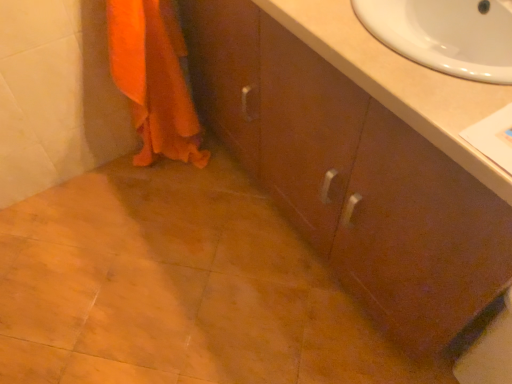
Question: Is matte brown cabinet at center next to beige laminate sink at upper right?

Choices:
 (A) no
 (B) yes

Answer: (A)

Question: Is matte brown cabinet at center located outside beige laminate sink at upper right?

Choices:
 (A) yes
 (B) no

Answer: (A)

Question: Is matte brown cabinet at center facing away from beige laminate sink at upper right?

Choices:
 (A) yes
 (B) no

Answer: (B)

Question: Does matte brown cabinet at center come behind beige laminate sink at upper right?

Choices:
 (A) no
 (B) yes

Answer: (A)

Question: Is matte brown cabinet at center at the left side of beige laminate sink at upper right?

Choices:
 (A) no
 (B) yes

Answer: (B)

Question: Does point (432, 167) appear closer or farther from the camera than point (196, 142)?

Choices:
 (A) closer
 (B) farther

Answer: (A)

Question: In the image, is matte brown cabinet at center positioned in front of or behind orange fabric towel at lower left?

Choices:
 (A) front
 (B) behind

Answer: (A)

Question: Based on their sizes in the image, would you say matte brown cabinet at center is bigger or smaller than orange fabric towel at lower left?

Choices:
 (A) small
 (B) big

Answer: (B)

Question: In terms of width, does matte brown cabinet at center look wider or thinner when compared to orange fabric towel at lower left?

Choices:
 (A) wide
 (B) thin

Answer: (A)

Question: Would you say orange fabric towel at lower left is to the left or to the right of matte brown cabinet at center in the picture?

Choices:
 (A) right
 (B) left

Answer: (B)

Question: Is point (155, 0) closer or farther from the camera than point (488, 254)?

Choices:
 (A) closer
 (B) farther

Answer: (B)

Question: From a real-world perspective, is orange fabric towel at lower left physically located above or below matte brown cabinet at center?

Choices:
 (A) above
 (B) below

Answer: (B)

Question: Is orange fabric towel at lower left bigger or smaller than matte brown cabinet at center?

Choices:
 (A) big
 (B) small

Answer: (B)

Question: In the image, is orange fabric towel at lower left on the left side or the right side of beige laminate sink at upper right?

Choices:
 (A) left
 (B) right

Answer: (A)

Question: From a real-world perspective, is orange fabric towel at lower left above or below beige laminate sink at upper right?

Choices:
 (A) above
 (B) below

Answer: (B)